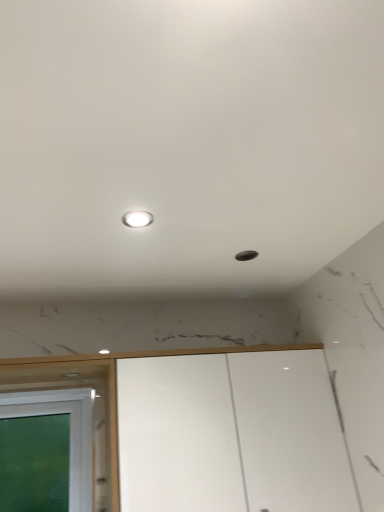
Question: Is white glossy cabinet at lower center wider or thinner than green glass window at lower left?

Choices:
 (A) wide
 (B) thin

Answer: (A)

Question: Is white glossy cabinet at lower center taller or shorter than green glass window at lower left?

Choices:
 (A) short
 (B) tall

Answer: (B)

Question: Based on their relative distances, which object is farther from the white glossy light at upper center?

Choices:
 (A) white glossy cabinet at lower center
 (B) green glass window at lower left

Answer: (B)

Question: Estimate the real-world distances between objects in this image. Which object is closer to the white glossy cabinet at lower center?

Choices:
 (A) white glossy light at upper center
 (B) green glass window at lower left

Answer: (B)